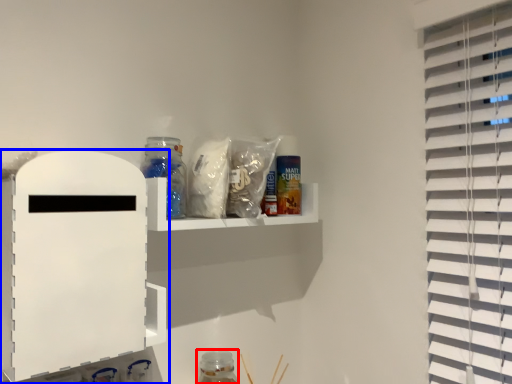
Question: Which object appears farthest to the camera in this image, bottle (highlighted by a red box) or shelf (highlighted by a blue box)?

Choices:
 (A) bottle
 (B) shelf

Answer: (A)